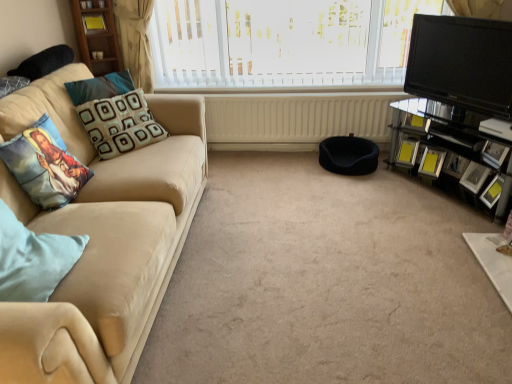
Question: Can you confirm if metallic silver picture frame at right, which is the fourth picture frame in front-to-back order, is taller than yellow glossy picture frame at right, the fourth picture frame from the back?

Choices:
 (A) yes
 (B) no

Answer: (A)

Question: Is metallic silver picture frame at right, which is the fourth picture frame in front-to-back order, to the right of yellow glossy picture frame at right, acting as the second picture frame starting from the front, from the viewer's perspective?

Choices:
 (A) yes
 (B) no

Answer: (B)

Question: Does metallic silver picture frame at right, which is the fourth picture frame in front-to-back order, come behind yellow glossy picture frame at right, acting as the second picture frame starting from the front?

Choices:
 (A) no
 (B) yes

Answer: (B)

Question: Does metallic silver picture frame at right, the 2th picture frame viewed from the back, have a smaller size compared to yellow glossy picture frame at right, the fourth picture frame from the back?

Choices:
 (A) yes
 (B) no

Answer: (B)

Question: Is metallic silver picture frame at right, which is the fourth picture frame in front-to-back order, facing away from yellow glossy picture frame at right, the fourth picture frame from the back?

Choices:
 (A) yes
 (B) no

Answer: (B)

Question: From a real-world perspective, is metallic silver picture frame at right, which is the fourth picture frame in front-to-back order, on top of yellow glossy picture frame at right, the fourth picture frame from the back?

Choices:
 (A) yes
 (B) no

Answer: (B)

Question: Does carpet at center have a larger size compared to matte black picture frame at right, which is the 3th picture frame from back to front?

Choices:
 (A) yes
 (B) no

Answer: (A)

Question: Is carpet at center facing away from matte black picture frame at right, which is counted as the 3th picture frame, starting from the front?

Choices:
 (A) no
 (B) yes

Answer: (A)

Question: Would you say carpet at center is a long distance from matte black picture frame at right, which is counted as the 3th picture frame, starting from the front?

Choices:
 (A) no
 (B) yes

Answer: (B)

Question: Considering the relative positions of carpet at center and matte black picture frame at right, which is the 3th picture frame from back to front, in the image provided, is carpet at center to the left of matte black picture frame at right, which is the 3th picture frame from back to front, from the viewer's perspective?

Choices:
 (A) no
 (B) yes

Answer: (B)

Question: Is carpet at center placed right next to matte black picture frame at right, which is the 3th picture frame from back to front?

Choices:
 (A) yes
 (B) no

Answer: (B)

Question: Does carpet at center appear on the right side of matte black picture frame at right, which is counted as the 3th picture frame, starting from the front?

Choices:
 (A) no
 (B) yes

Answer: (A)

Question: Can you confirm if printed fabric pillow at left, acting as the second pillow starting from the back, is thinner than matte black picture frame at right, which is counted as the 3th picture frame, starting from the front?

Choices:
 (A) yes
 (B) no

Answer: (B)